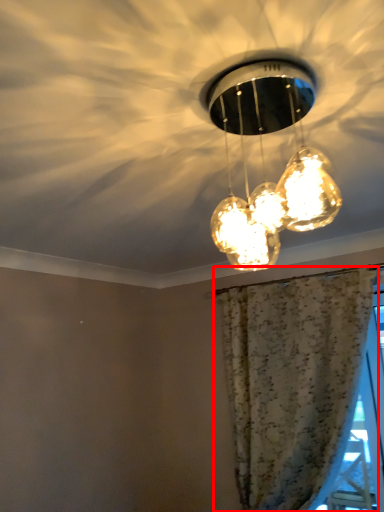
Question: Where is curtain (annotated by the red box) located in relation to lamp in the image?

Choices:
 (A) right
 (B) left

Answer: (A)